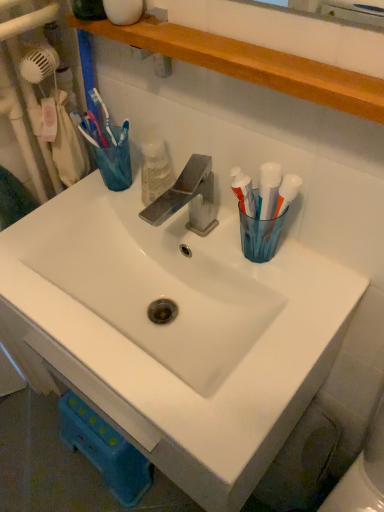
Question: Is wooden shelf at upper center positioned before translucent plastic toothbrush at upper left?

Choices:
 (A) no
 (B) yes

Answer: (B)

Question: Considering the relative sizes of wooden shelf at upper center and translucent plastic toothbrush at upper left in the image provided, is wooden shelf at upper center taller than translucent plastic toothbrush at upper left?

Choices:
 (A) no
 (B) yes

Answer: (A)

Question: Considering the relative positions of wooden shelf at upper center and translucent plastic toothbrush at upper left in the image provided, is wooden shelf at upper center to the left of translucent plastic toothbrush at upper left from the viewer's perspective?

Choices:
 (A) yes
 (B) no

Answer: (B)

Question: From the image's perspective, does wooden shelf at upper center appear lower than translucent plastic toothbrush at upper left?

Choices:
 (A) no
 (B) yes

Answer: (A)

Question: Can you confirm if wooden shelf at upper center is smaller than translucent plastic toothbrush at upper left?

Choices:
 (A) yes
 (B) no

Answer: (B)

Question: Would you say translucent plastic toothbrush at upper left is to the left or to the right of wooden shelf at upper center in the picture?

Choices:
 (A) right
 (B) left

Answer: (B)

Question: Is translucent plastic toothbrush at upper left bigger or smaller than wooden shelf at upper center?

Choices:
 (A) small
 (B) big

Answer: (A)

Question: Looking at their shapes, would you say translucent plastic toothbrush at upper left is wider or thinner than wooden shelf at upper center?

Choices:
 (A) thin
 (B) wide

Answer: (A)

Question: Is point tap(92, 139) positioned closer to the camera than point tap(142, 20)?

Choices:
 (A) farther
 (B) closer

Answer: (A)

Question: Is point [167, 330] closer or farther from the camera than point [114, 29]?

Choices:
 (A) farther
 (B) closer

Answer: (A)

Question: From the image's perspective, is white ceramic sink at center above or below wooden shelf at upper center?

Choices:
 (A) above
 (B) below

Answer: (B)

Question: From a real-world perspective, relative to wooden shelf at upper center, is white ceramic sink at center vertically above or below?

Choices:
 (A) below
 (B) above

Answer: (A)

Question: In the image, is white ceramic sink at center on the left side or the right side of wooden shelf at upper center?

Choices:
 (A) left
 (B) right

Answer: (A)

Question: Would you say wooden shelf at upper center is to the left or to the right of white ceramic sink at center in the picture?

Choices:
 (A) left
 (B) right

Answer: (B)

Question: Considering the positions of point (218, 57) and point (140, 246), is point (218, 57) closer or farther from the camera than point (140, 246)?

Choices:
 (A) farther
 (B) closer

Answer: (B)